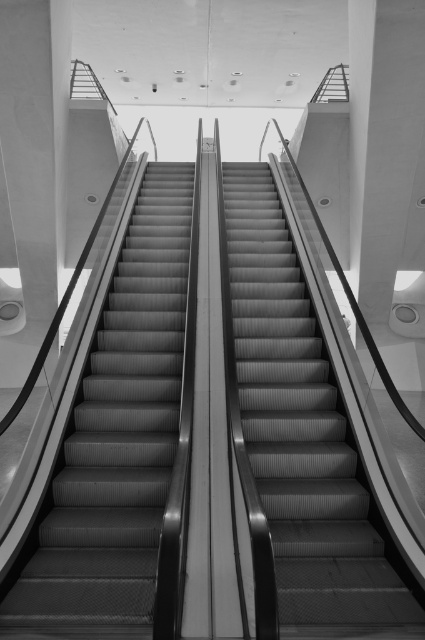
Question: Does metallic gray stairs at left appear on the right side of metallic gray escalator at center?

Choices:
 (A) yes
 (B) no

Answer: (B)

Question: Among these points, which one is nearest to the camera?

Choices:
 (A) (337, 602)
 (B) (141, 627)

Answer: (B)

Question: Can you confirm if metallic gray stairs at left is smaller than metallic gray escalator at center?

Choices:
 (A) no
 (B) yes

Answer: (A)

Question: Which object is closer to the camera taking this photo?

Choices:
 (A) metallic gray escalator at center
 (B) metallic gray stairs at left

Answer: (A)

Question: Does metallic gray stairs at left come in front of metallic gray escalator at center?

Choices:
 (A) no
 (B) yes

Answer: (A)